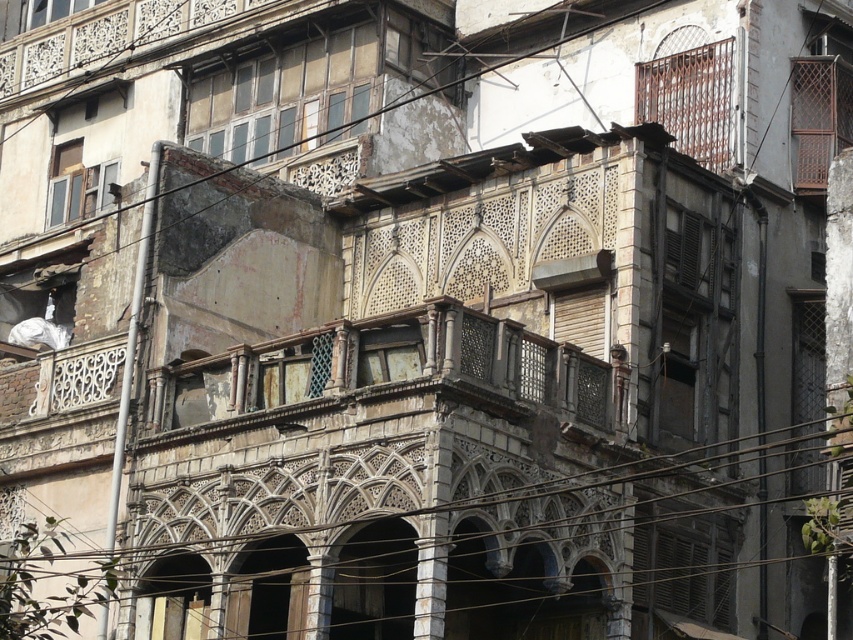
Find the location of a particular element. This screenshot has height=640, width=853. metallic wire at upper center is located at coordinates (287, 102).

Which is in front, point (12, 147) or point (496, 410)?

Point (496, 410)

In order to click on metallic wire at upper center in this screenshot , I will do `click(287, 102)`.